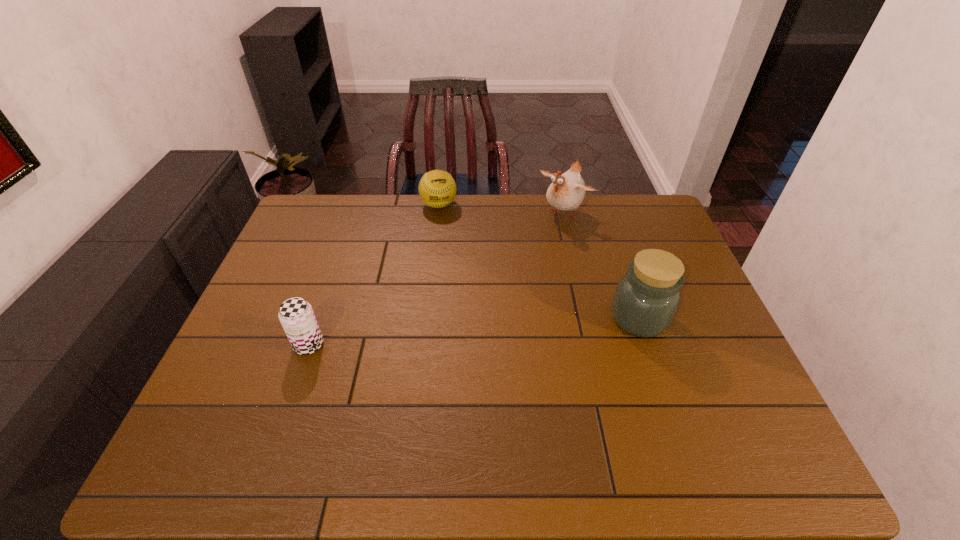
Where is `vacant space located 0.060m on the logo side of the third object from right to left`? vacant space located 0.060m on the logo side of the third object from right to left is located at coordinates (444, 226).

Image resolution: width=960 pixels, height=540 pixels. Find the location of `free space located 0.060m on the logo side of the third object from right to left`. free space located 0.060m on the logo side of the third object from right to left is located at coordinates (444, 226).

Locate an element on the screen. The image size is (960, 540). bird that is positioned at the far edge is located at coordinates (566, 192).

The height and width of the screenshot is (540, 960). In order to click on softball located at the far edge in this screenshot , I will do `click(437, 189)`.

The width and height of the screenshot is (960, 540). What are the coordinates of `object at the left edge` in the screenshot? It's located at (296, 315).

Locate an element on the screen. object that is at the right edge is located at coordinates (647, 297).

This screenshot has height=540, width=960. Find the location of `vacant space at the far edge of the desktop`. vacant space at the far edge of the desktop is located at coordinates (364, 198).

Where is `free space at the near edge of the desktop`? Image resolution: width=960 pixels, height=540 pixels. free space at the near edge of the desktop is located at coordinates (611, 391).

Find the location of a particular element. The image size is (960, 540). free space at the left edge is located at coordinates (318, 237).

Identify the location of vacant area at the far left corner. This screenshot has width=960, height=540. (307, 218).